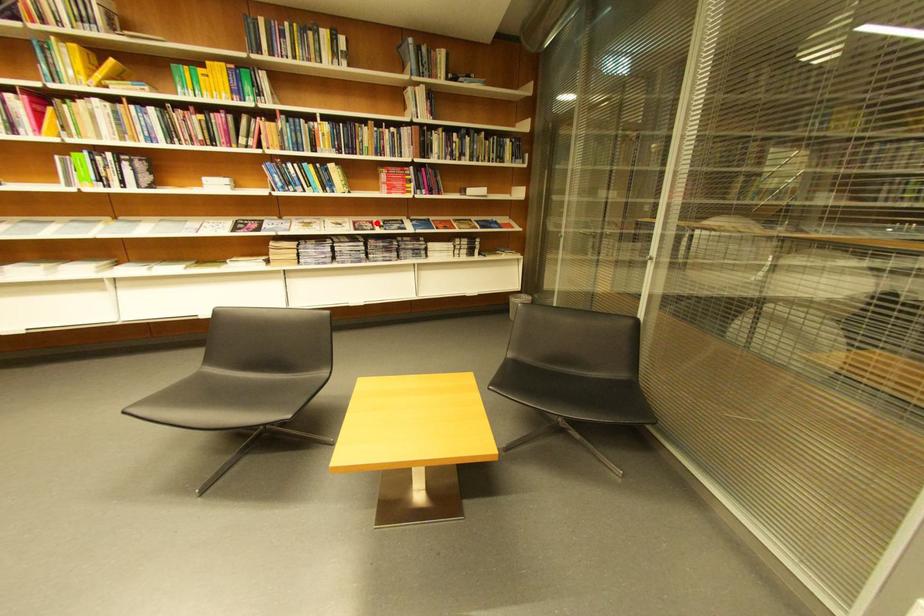
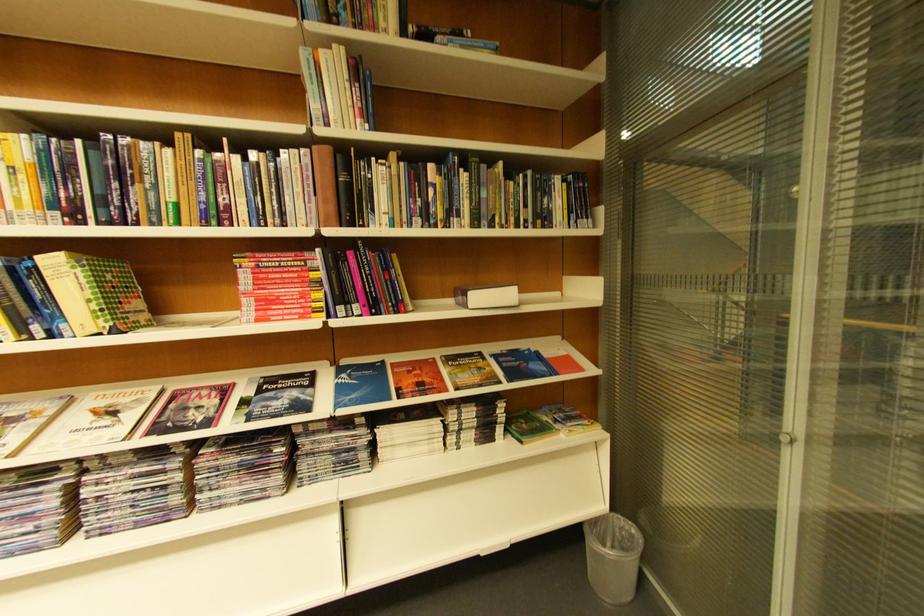
Question: I am providing you with two images of the same scene from different viewpoints. A red point is marked on the first image. Can you still see the location of the red point in image 2?

Choices:
 (A) Yes
 (B) No

Answer: (A)